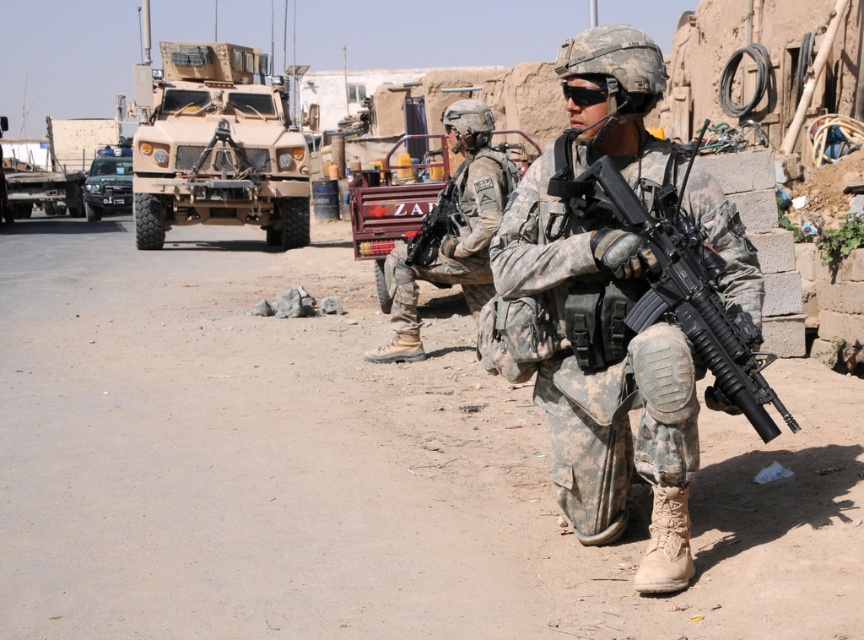
Question: Is camouflage fabric uniform at center behind matte black rifle at center?

Choices:
 (A) no
 (B) yes

Answer: (A)

Question: Is matte tan military vehicle at upper left smaller than matte black rifle at center?

Choices:
 (A) yes
 (B) no

Answer: (B)

Question: Which object appears farthest from the camera in this image?

Choices:
 (A) dark green matte truck at left
 (B) black matte rifle at center

Answer: (A)

Question: Based on their relative distances, which object is farther from the camouflage fabric uniform at center?

Choices:
 (A) dark green matte truck at left
 (B) camouflage uniform at center
 (C) black matte rifle at center

Answer: (A)

Question: Which point is closer to the camera?

Choices:
 (A) (678, 196)
 (B) (140, 96)

Answer: (A)

Question: Is matte tan military vehicle at upper left positioned before dark green matte truck at left?

Choices:
 (A) yes
 (B) no

Answer: (A)